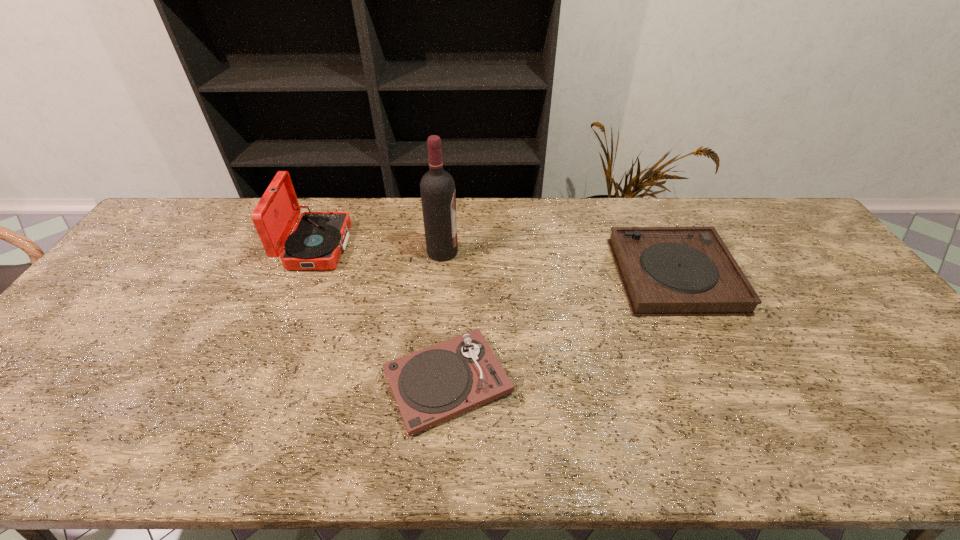
Find the location of `vacant position in the image that satisfies the following two spatial constraints: 1. on the label of the nearest object; 2. on the left side of the wine bottle`. vacant position in the image that satisfies the following two spatial constraints: 1. on the label of the nearest object; 2. on the left side of the wine bottle is located at coordinates (430, 382).

Where is `free point that satisfies the following two spatial constraints: 1. on the front-facing side of the third shortest object; 2. on the right side of the rightmost object`? The image size is (960, 540). free point that satisfies the following two spatial constraints: 1. on the front-facing side of the third shortest object; 2. on the right side of the rightmost object is located at coordinates (305, 275).

Locate an element on the screen. The height and width of the screenshot is (540, 960). free location that satisfies the following two spatial constraints: 1. on the back side of the rightmost object; 2. on the label of the tallest object is located at coordinates (663, 252).

Locate an element on the screen. free location that satisfies the following two spatial constraints: 1. on the label of the wine bottle; 2. on the left side of the second phonograph_record from left to right is located at coordinates (430, 382).

Where is `vacant position in the image that satisfies the following two spatial constraints: 1. on the label of the tallest object; 2. on the back side of the rightmost object`? This screenshot has height=540, width=960. vacant position in the image that satisfies the following two spatial constraints: 1. on the label of the tallest object; 2. on the back side of the rightmost object is located at coordinates (441, 275).

Locate an element on the screen. The height and width of the screenshot is (540, 960). free space that satisfies the following two spatial constraints: 1. on the front-facing side of the leftmost phonograph_record; 2. on the back side of the nearest phonograph_record is located at coordinates (261, 382).

You are a GUI agent. You are given a task and a screenshot of the screen. Output one action in this format:
    pyautogui.click(x=<x>, y=<y>)
    Task: Click on the free space in the image that satisfies the following two spatial constraints: 1. on the front-facing side of the leftmost phonograph_record; 2. on the right side of the second phonograph_record from left to right
    The height and width of the screenshot is (540, 960).
    Given the screenshot: What is the action you would take?
    pyautogui.click(x=261, y=382)

Identify the location of free location that satisfies the following two spatial constraints: 1. on the front-facing side of the rightmost object; 2. on the right side of the leftmost phonograph_record. The image size is (960, 540). (305, 275).

You are a GUI agent. You are given a task and a screenshot of the screen. Output one action in this format:
    pyautogui.click(x=<x>, y=<y>)
    Task: Click on the blank space that satisfies the following two spatial constraints: 1. on the front-facing side of the leftmost object; 2. on the back side of the rightmost object
    The width and height of the screenshot is (960, 540).
    Given the screenshot: What is the action you would take?
    pyautogui.click(x=305, y=275)

You are a GUI agent. You are given a task and a screenshot of the screen. Output one action in this format:
    pyautogui.click(x=<x>, y=<y>)
    Task: Click on the vacant space that satisfies the following two spatial constraints: 1. on the label of the nearest phonograph_record; 2. on the right side of the wine bottle
    
    Given the screenshot: What is the action you would take?
    pyautogui.click(x=430, y=382)